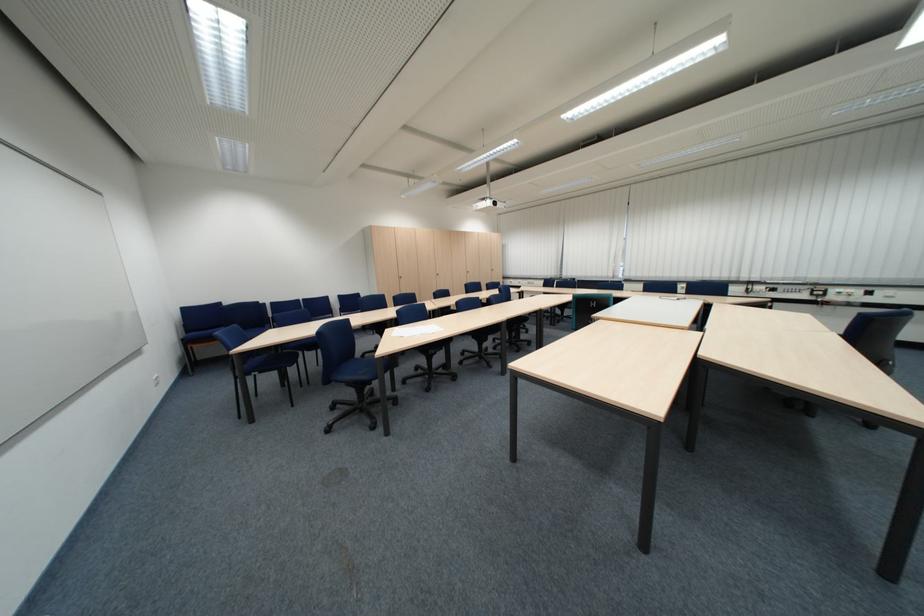
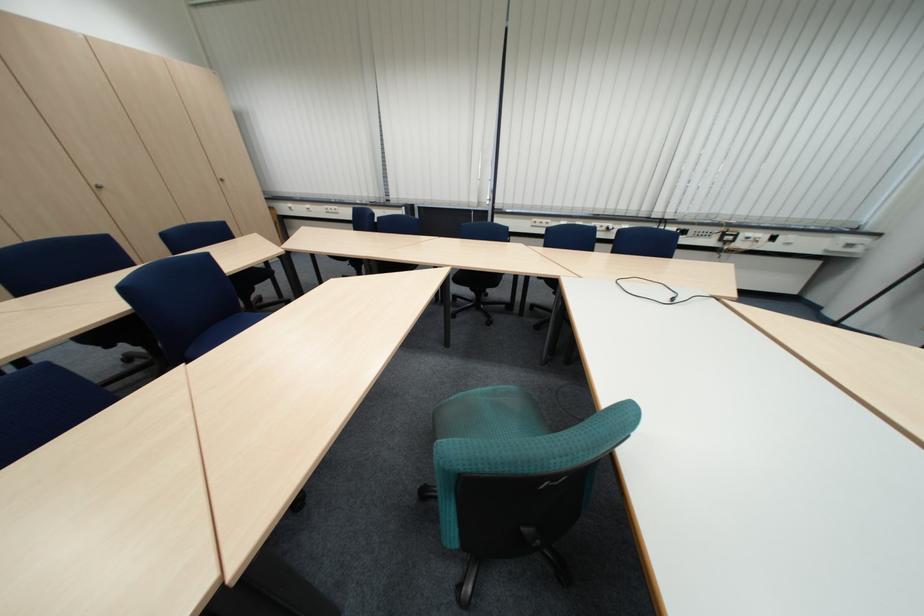
Where in the second image is the point corresponding to point (847, 291) from the first image?

(759, 235)